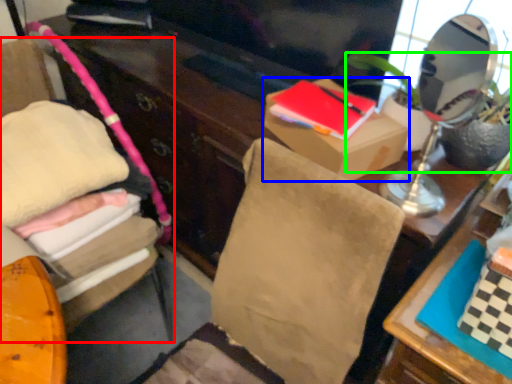
Question: Considering the real-world distances, which object is closest to furniture (highlighted by a red box)? box (highlighted by a blue box) or houseplant (highlighted by a green box).

Choices:
 (A) box
 (B) houseplant

Answer: (A)